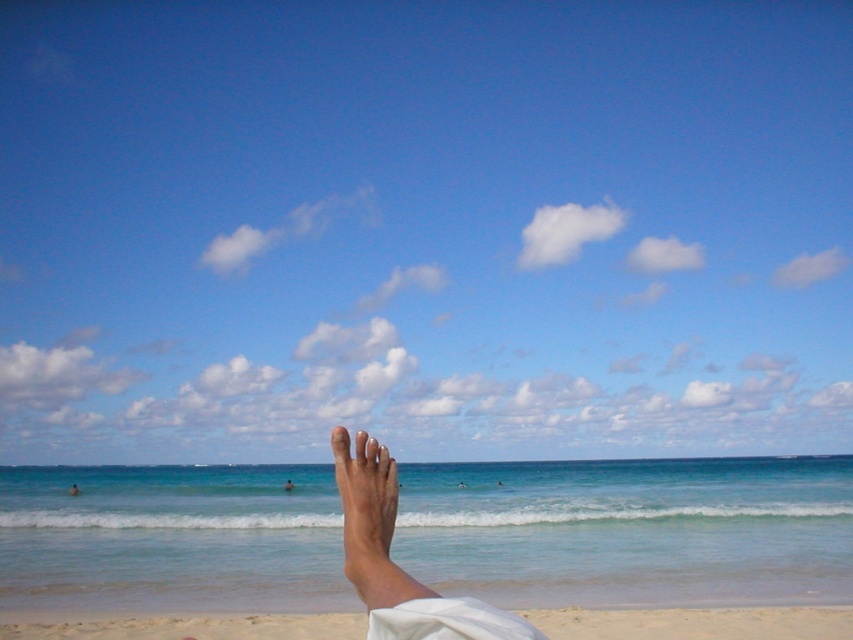
You are standing at the edge of the ocean looking towards the horizon. There is a point marked at coordinates [695,621] in the image. According to the scene description, what is the location of this point relative to the white sandy beach at lower center?

The point at coordinates [695,621] corresponds to the white sandy beach at lower center, so it is located exactly at that position.

You are standing on the white sandy beach at lower center and want to reach the white matte foot at center. In which direction should you move?

The white sandy beach at lower center is to the right of the white matte foot at center, so you should move to the left to reach it.

In the scene shown: You are standing on the white sandy beach at lower center and want to place the white matte foot at center on it. Can you determine if the beach is wide enough to accommodate the foot?

The white sandy beach at lower center might be wider than white matte foot at center, so it is possible that the beach is wide enough to accommodate the foot.